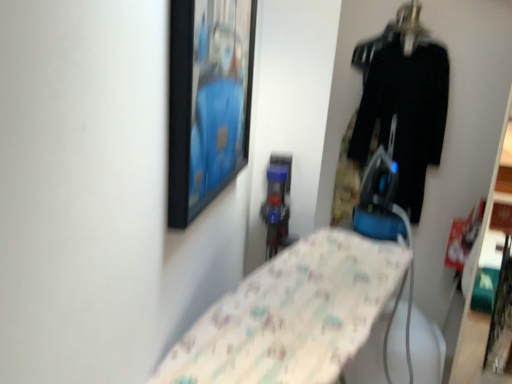
Question: Is metallic hanger at upper right positioned beyond the bounds of black fabric pants at right?

Choices:
 (A) no
 (B) yes

Answer: (B)

Question: Does metallic hanger at upper right have a greater width compared to black fabric pants at right?

Choices:
 (A) no
 (B) yes

Answer: (B)

Question: Considering the relative sizes of metallic hanger at upper right and black fabric pants at right in the image provided, is metallic hanger at upper right bigger than black fabric pants at right?

Choices:
 (A) yes
 (B) no

Answer: (B)

Question: From a real-world perspective, is metallic hanger at upper right located higher than black fabric pants at right?

Choices:
 (A) yes
 (B) no

Answer: (A)

Question: Is metallic hanger at upper right oriented towards black fabric pants at right?

Choices:
 (A) no
 (B) yes

Answer: (A)

Question: Would you say black fabric pants at right is part of metallic hanger at upper right's contents?

Choices:
 (A) no
 (B) yes

Answer: (A)

Question: Are black fabric pants at right and black matte picture frame at upper center located far from each other?

Choices:
 (A) yes
 (B) no

Answer: (A)

Question: Is black fabric pants at right closer to the viewer compared to black matte picture frame at upper center?

Choices:
 (A) yes
 (B) no

Answer: (B)

Question: Does black fabric pants at right appear on the left side of black matte picture frame at upper center?

Choices:
 (A) no
 (B) yes

Answer: (A)

Question: Is black fabric pants at right thinner than black matte picture frame at upper center?

Choices:
 (A) no
 (B) yes

Answer: (A)

Question: From the image's perspective, is black fabric pants at right below black matte picture frame at upper center?

Choices:
 (A) yes
 (B) no

Answer: (B)

Question: Is black fabric pants at right oriented towards black matte picture frame at upper center?

Choices:
 (A) no
 (B) yes

Answer: (A)

Question: Is black fabric pants at right positioned beyond the bounds of metallic hanger at upper right?

Choices:
 (A) no
 (B) yes

Answer: (B)